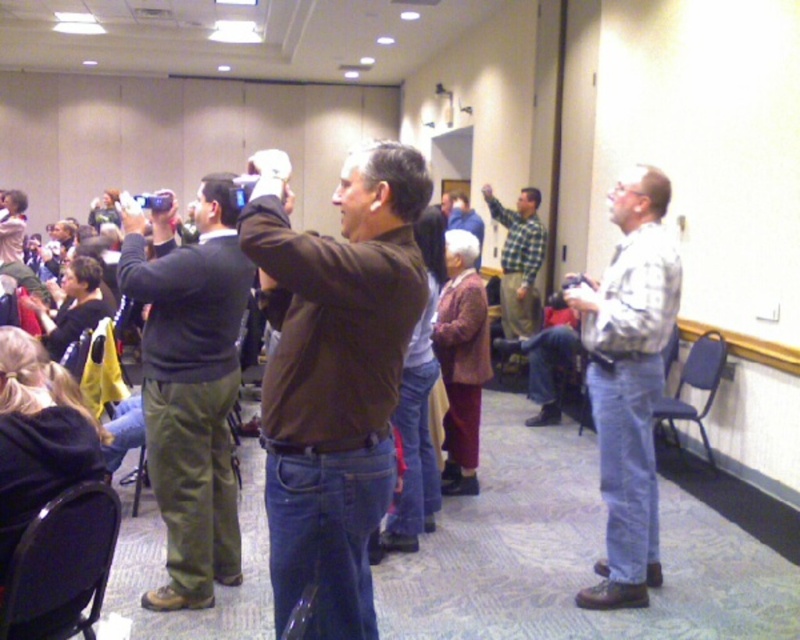
Who is positioned more to the left, brown matte jacket at center or plaid shirt at right?

brown matte jacket at center

Does point (364, 324) lie in front of point (636, 580)?

Yes, point (364, 324) is closer to viewer.

Locate an element on the screen. brown matte jacket at center is located at coordinates [334, 372].

Consider the image. Can you confirm if dark green pants at center is positioned below plaid shirt at right?

Correct, dark green pants at center is located below plaid shirt at right.

What do you see at coordinates (190, 385) in the screenshot?
I see `dark green pants at center` at bounding box center [190, 385].

Identify the location of dark green pants at center. (190, 385).

Between plaid shirt at right and checkered fabric shirt at center, which one has more height?

plaid shirt at right

Is point (628, 291) in front of point (522, 305)?

Yes.

Find the location of a particular element. This screenshot has width=800, height=640. plaid shirt at right is located at coordinates (628, 380).